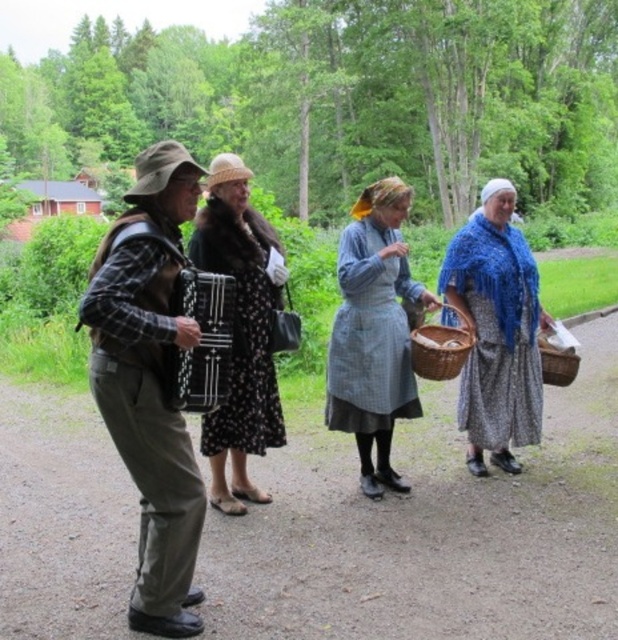
You are a photographer standing behind the group of people in the image. You want to take a photo that focuses on the black dotted dress at center and the woven brown basket at center. Which object will appear larger in the photo?

The black dotted dress at center will appear larger in the photo because it is closer to the viewer than the woven brown basket at center.

In the scene shown: You are a photographer trying to capture a group photo of the people in the image. You want to ensure that both the black dotted dress at center and the woven brown basket at center are clearly visible. Based on their positions, which one should you focus on first to ensure both are in frame?

The black dotted dress at center is positioned on the left side of the woven brown basket at center. To ensure both are in frame, focus on the woven brown basket at center first since it is on the right, allowing you to adjust the camera to include both from left to right.